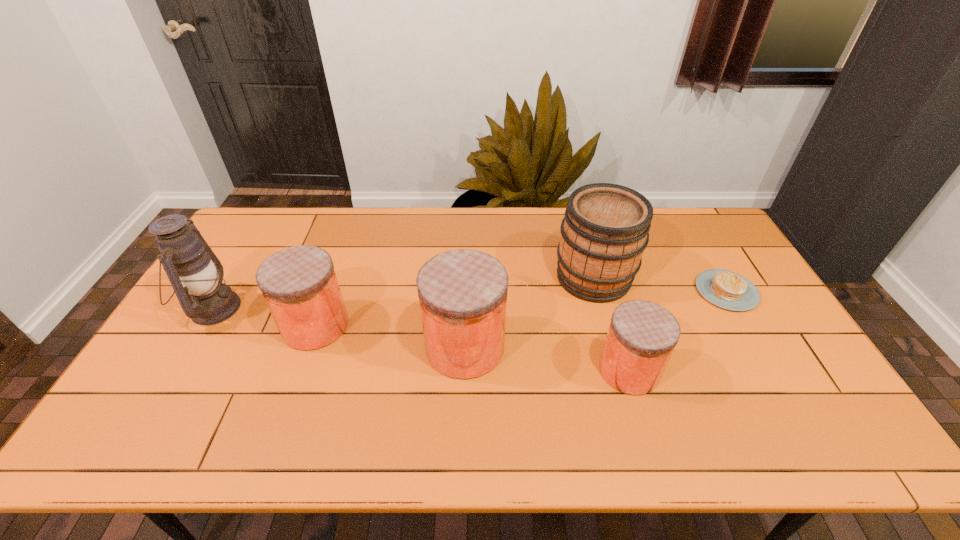
Find the location of a particular element. vacant area at the right edge is located at coordinates (x=734, y=268).

This screenshot has width=960, height=540. What are the coordinates of `free point at the far left corner` in the screenshot? It's located at (270, 221).

You are a GUI agent. You are given a task and a screenshot of the screen. Output one action in this format:
    pyautogui.click(x=<x>, y=<y>)
    Task: Click on the vacant space at the far right corner
    
    Given the screenshot: What is the action you would take?
    pyautogui.click(x=679, y=211)

Locate an element on the screen. The image size is (960, 540). vacant area at the near right corner is located at coordinates (800, 408).

Identify the location of free space between the shortest object and the second jar from left to right. Image resolution: width=960 pixels, height=540 pixels. (595, 319).

The width and height of the screenshot is (960, 540). Find the location of `free spot between the rightmost jar and the third object from left to right`. free spot between the rightmost jar and the third object from left to right is located at coordinates (547, 359).

Where is `vacant region between the leftmost object and the leftmost jar`? vacant region between the leftmost object and the leftmost jar is located at coordinates (265, 317).

Locate an element on the screen. empty space that is in between the pancake and the cider is located at coordinates (660, 284).

At what (x,y) coordinates should I click in order to perform the action: click on vacant region between the fourth tallest object and the rightmost object. Please return your answer as a coordinate pair (x, y). The image size is (960, 540). Looking at the image, I should click on (521, 308).

At what (x,y) coordinates should I click in order to perform the action: click on vacant area that lies between the second object from left to right and the fourth object from right to left. Please return your answer as a coordinate pair (x, y). The image size is (960, 540). Looking at the image, I should click on (391, 336).